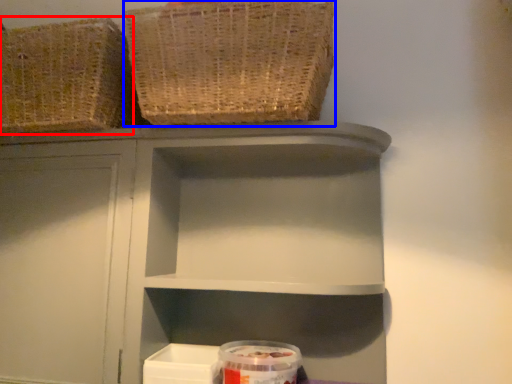
Question: Which object is further to the camera taking this photo, basket (highlighted by a red box) or basket (highlighted by a blue box)?

Choices:
 (A) basket
 (B) basket

Answer: (A)